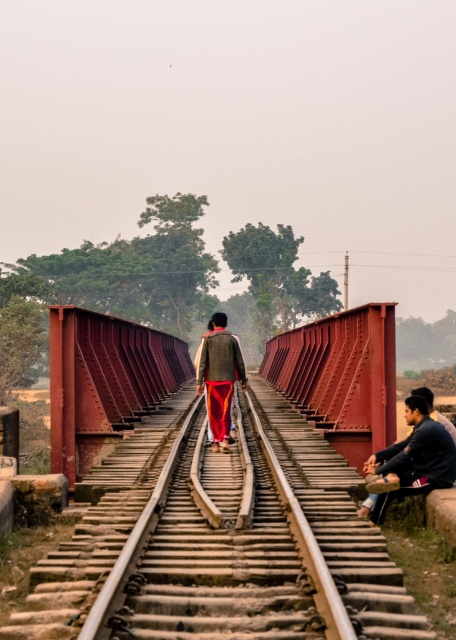
Is dark blue fabric jacket at lower right taller than textured woolen sweater at center?

Yes.

Between dark blue fabric jacket at lower right and textured woolen sweater at center, which one is positioned lower?

textured woolen sweater at center

In the scene shown: Who is more distant from viewer, (x=376, y=509) or (x=206, y=388)?

The point (x=206, y=388) is more distant.

Where is `dark blue fabric jacket at lower right`? The height and width of the screenshot is (640, 456). dark blue fabric jacket at lower right is located at coordinates (413, 458).

This screenshot has height=640, width=456. What do you see at coordinates (219, 552) in the screenshot?
I see `rusty metal train track at center` at bounding box center [219, 552].

Which is more to the right, rusty metal train track at center or rusty metal bridge at center?

Positioned to the right is rusty metal train track at center.

Is point (181, 625) closer to camera compared to point (128, 417)?

Yes, point (181, 625) is in front of point (128, 417).

I want to click on rusty metal train track at center, so click(219, 552).

Can you confirm if rusty metal train track at center is thinner than textured woolen sweater at center?

No.

Between point (149, 564) and point (241, 358), which one is positioned behind?

The point (241, 358) is behind.

Find the location of `rusty metal train track at center`. rusty metal train track at center is located at coordinates (219, 552).